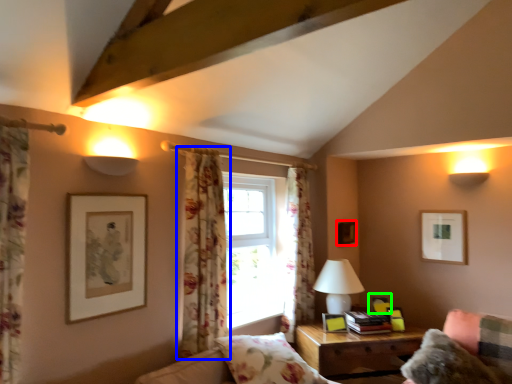
Question: Which object is positioned closest to picture frame (highlighted by a red box)? Select from curtain (highlighted by a blue box) and picture frame (highlighted by a green box).

Choices:
 (A) curtain
 (B) picture frame

Answer: (B)